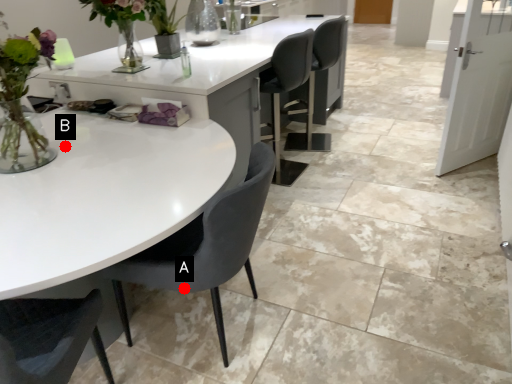
Question: Two points are circled on the image, labeled by A and B beside each circle. Which point appears closest to the camera in this image?

Choices:
 (A) A is closer
 (B) B is closer

Answer: (A)